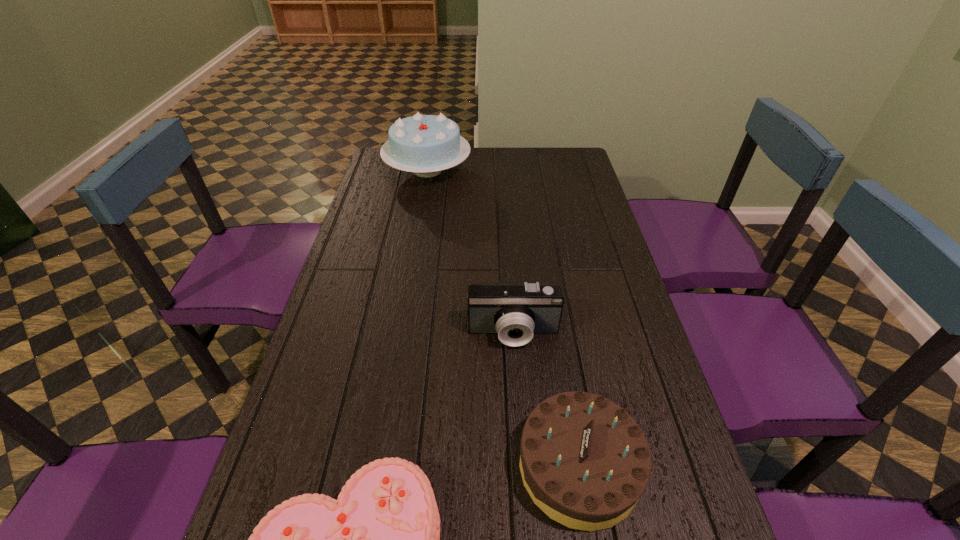
Find the location of `the second closest object relative to the taller birthday cake`. the second closest object relative to the taller birthday cake is located at coordinates (584, 461).

This screenshot has height=540, width=960. What are the coordinates of `object that ranks as the third closest to the taller birthday cake` in the screenshot? It's located at (380, 539).